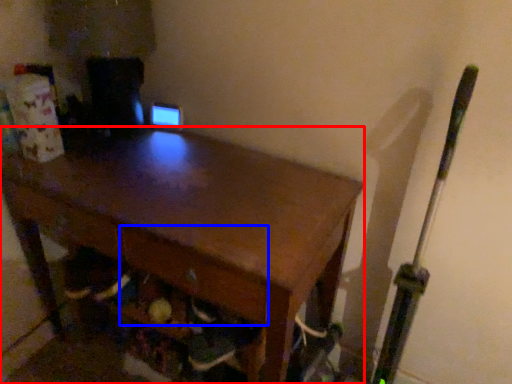
Question: Which point is closer to the camera, desk (highlighted by a red box) or drawer (highlighted by a blue box)?

Choices:
 (A) desk
 (B) drawer

Answer: (A)